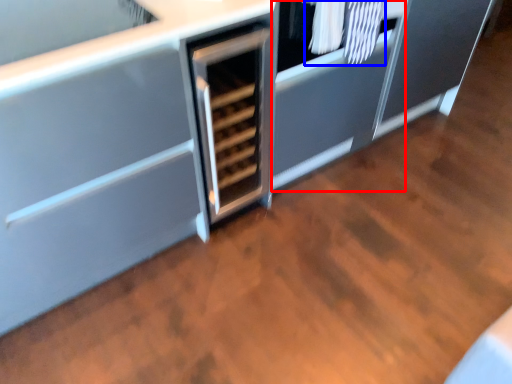
Question: Among these objects, which one is farthest to the camera, cabinetry (highlighted by a red box) or laundry (highlighted by a blue box)?

Choices:
 (A) cabinetry
 (B) laundry

Answer: (A)